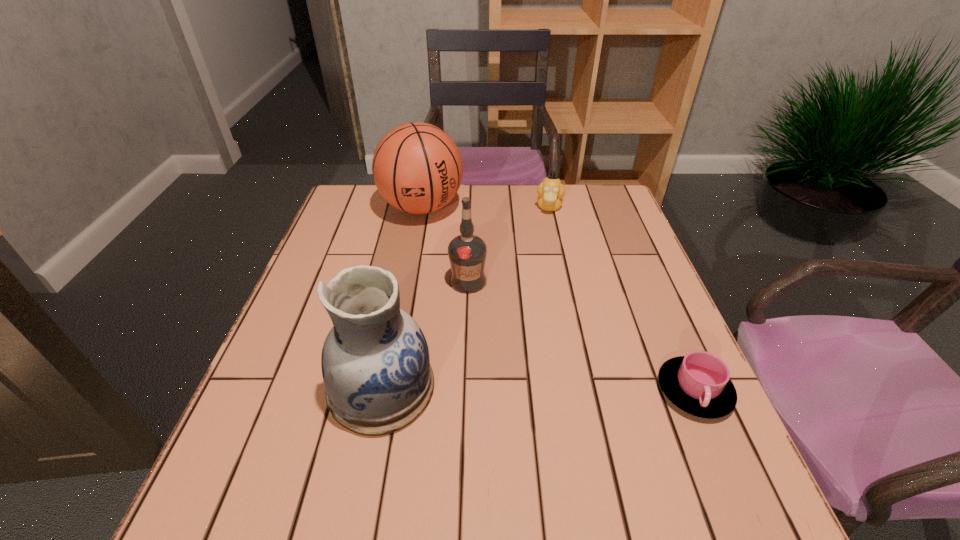
I want to click on free space on the desktop that is between the pottery and the cup and is positioned on the surface of the basketball near the brand logo, so click(x=528, y=389).

This screenshot has width=960, height=540. In order to click on vacant space on the desktop that is between the pottery and the cup and is positioned on the front label of the third farthest object in this screenshot , I will do `click(543, 389)`.

Where is `vacant spot on the desktop that is between the pottery and the cup and is positioned on the face of the fourth object from left to right`? This screenshot has width=960, height=540. vacant spot on the desktop that is between the pottery and the cup and is positioned on the face of the fourth object from left to right is located at coordinates (524, 389).